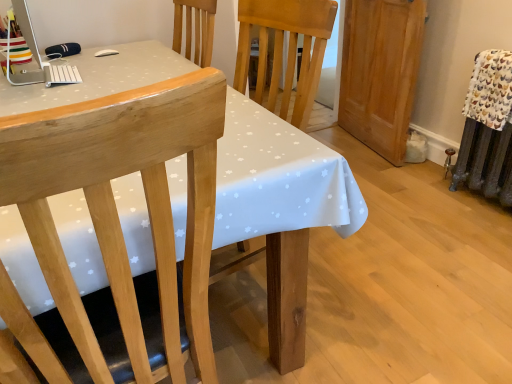
Question: From the image's perspective, is white plastic desktop computer at upper left positioned above or below white fabric with chicken print at right?

Choices:
 (A) below
 (B) above

Answer: (B)

Question: In the image, is white plastic desktop computer at upper left on the left side or the right side of white fabric with chicken print at right?

Choices:
 (A) left
 (B) right

Answer: (A)

Question: Based on their relative distances, which object is farther from the white dotted fabric at center?

Choices:
 (A) natural wood chair at left
 (B) white fabric with chicken print at right
 (C) light brown wood armoire at right
 (D) white plastic desktop computer at upper left

Answer: (B)

Question: Considering the real-world distances, which object is closest to the white plastic desktop computer at upper left?

Choices:
 (A) light brown wood armoire at right
 (B) white dotted fabric at center
 (C) white fabric with chicken print at right
 (D) natural wood chair at left

Answer: (B)